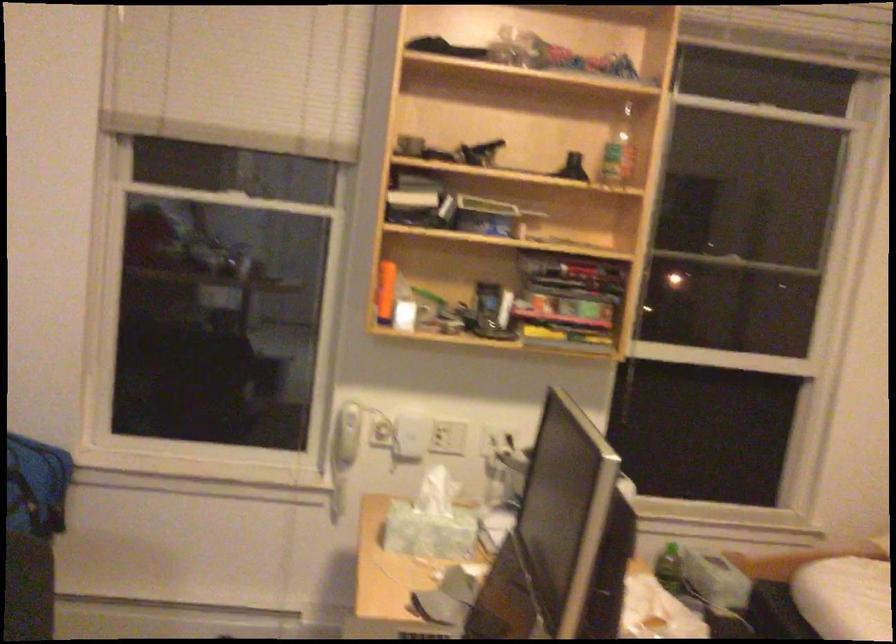
Where would you grasp the green plastic bottle? Please return your answer as a coordinate pair (x, y).

(669, 567)